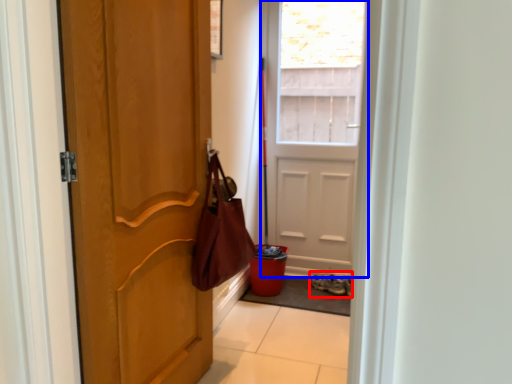
Question: Which of the following is the farthest to the observer, footwear (highlighted by a red box) or door (highlighted by a blue box)?

Choices:
 (A) footwear
 (B) door

Answer: (A)